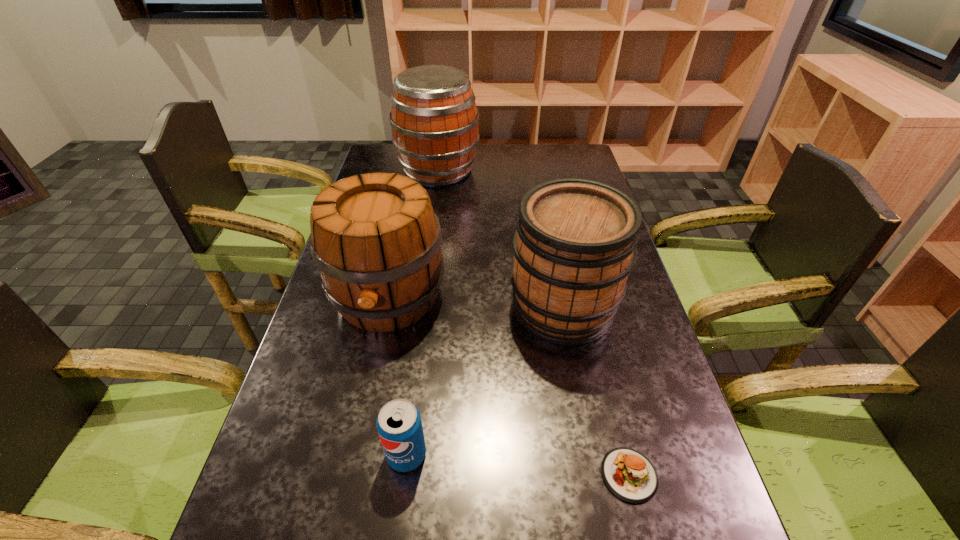
Image resolution: width=960 pixels, height=540 pixels. I want to click on object that stands as the closest to the farthest cider, so click(377, 246).

Identify which cider is located as the third nearest to the shortest object. Please provide its 2D coordinates. Your answer should be formatted as a tuple, i.e. [(x, y)], where the tuple contains the x and y coordinates of a point satisfying the conditions above.

[(435, 122)]

Identify the location of cider that can be found as the closest to the second shortest object. The width and height of the screenshot is (960, 540). (377, 246).

Locate an element on the screen. vacant point that satisfies the following two spatial constraints: 1. on the front side of the farthest object; 2. on the right side of the rightmost cider is located at coordinates (420, 307).

You are a GUI agent. You are given a task and a screenshot of the screen. Output one action in this format:
    pyautogui.click(x=<x>, y=<y>)
    Task: Click on the vacant space that satisfies the following two spatial constraints: 1. on the front side of the farthest cider; 2. on the left side of the shortest object
    The height and width of the screenshot is (540, 960).
    Given the screenshot: What is the action you would take?
    pyautogui.click(x=396, y=475)

Locate an element on the screen. free spot that satisfies the following two spatial constraints: 1. on the front side of the shortest object; 2. on the left side of the soda can is located at coordinates (404, 475).